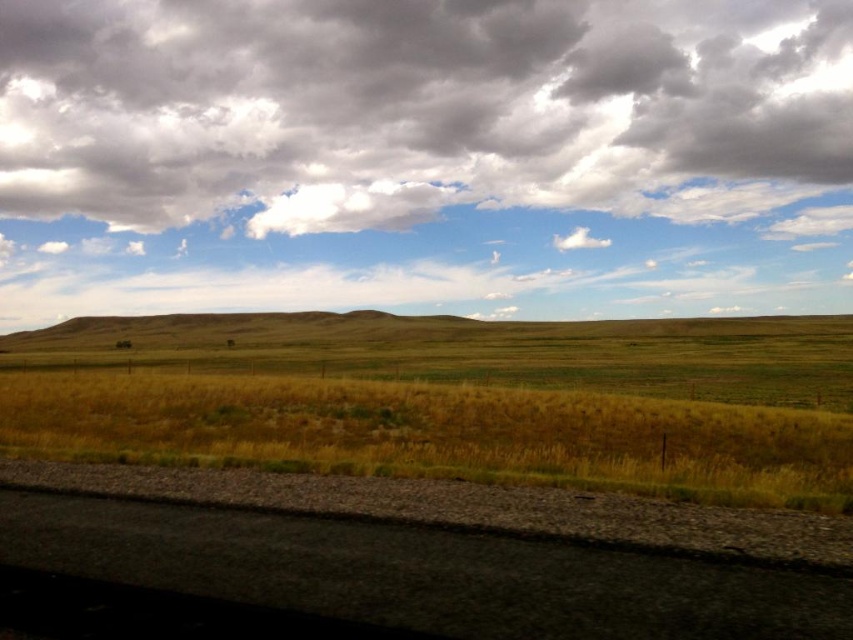
You are a gardener who needs to mow the yellow dry grass at center and the black asphalt train track at lower left. Which area requires mowing first based on their heights?

The yellow dry grass at center is taller than the black asphalt train track at lower left, so you should mow the yellow dry grass at center first.